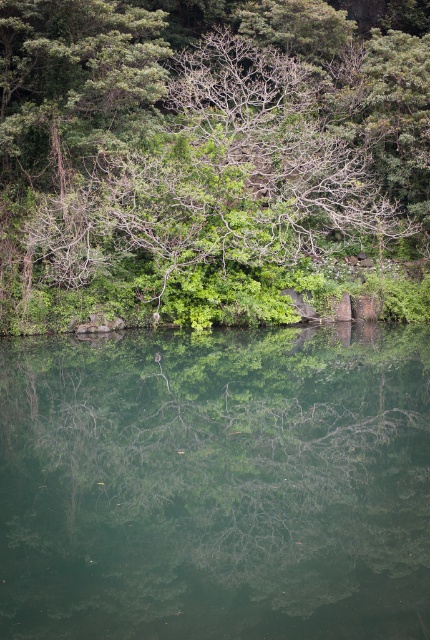
Is green reflective water at center to the right of green leafy tree at center from the viewer's perspective?

No, green reflective water at center is not to the right of green leafy tree at center.

Is green reflective water at center thinner than green leafy tree at center?

Yes.

Measure the distance between point (55, 547) and camera.

The distance of point (55, 547) from camera is 11.31 meters.

Identify the location of green reflective water at center. (215, 483).